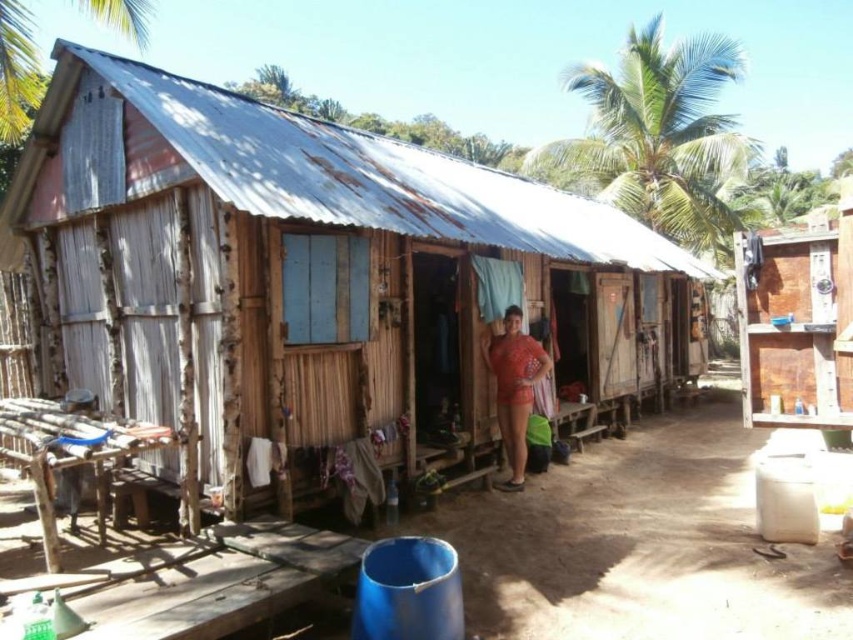
Does wooden cabinet at right appear under matte red shorts at center?

No, wooden cabinet at right is not below matte red shorts at center.

Does wooden cabinet at right come behind matte red shorts at center?

No, wooden cabinet at right is closer to the viewer.

The width and height of the screenshot is (853, 640). I want to click on wooden cabinet at right, so click(798, 321).

In the scene shown: Can you confirm if green leafy palm tree at upper center is wider than matte red shorts at center?

Yes, green leafy palm tree at upper center is wider than matte red shorts at center.

Is point (131, 26) less distant than point (500, 481)?

No, (131, 26) is further to viewer.

The height and width of the screenshot is (640, 853). I want to click on green leafy palm tree at upper center, so (x=16, y=70).

Is point (608, 164) positioned behind point (502, 392)?

Yes, it is behind point (502, 392).

Who is more forward, [631,138] or [521,484]?

Point [521,484] is in front.

Is point (585, 80) behind point (509, 332)?

Yes, point (585, 80) is farther from viewer.

Locate an element on the screen. green leafy palm tree at upper right is located at coordinates (659, 138).